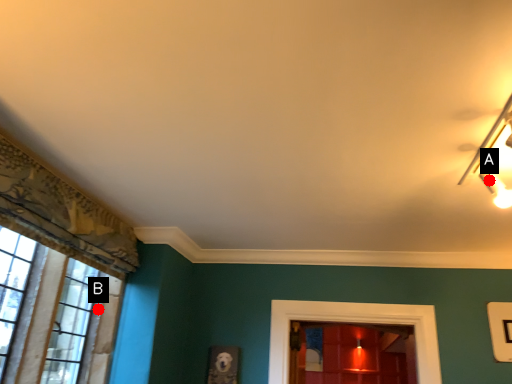
Question: Two points are circled on the image, labeled by A and B beside each circle. Among these points, which one is farthest from the camera?

Choices:
 (A) A is further
 (B) B is further

Answer: (B)